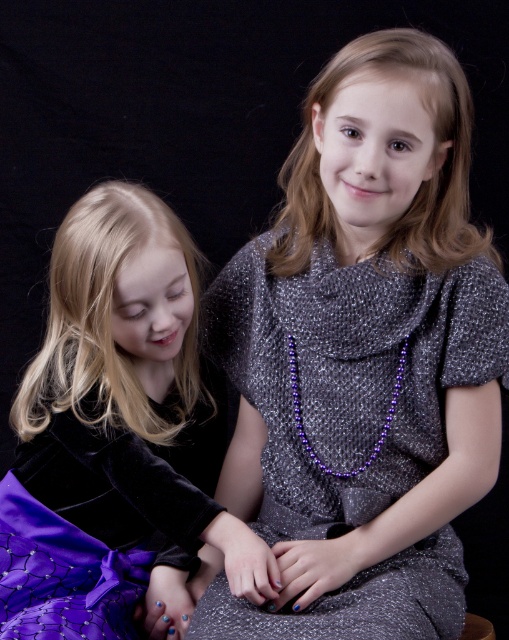
Is sparkly silver dress at center wider than purple velvet skirt at lower left?

Correct, the width of sparkly silver dress at center exceeds that of purple velvet skirt at lower left.

Does point (272, 413) lie in front of point (192, 426)?

Yes, point (272, 413) is closer to viewer.

This screenshot has height=640, width=509. Identify the location of sparkly silver dress at center. (351, 372).